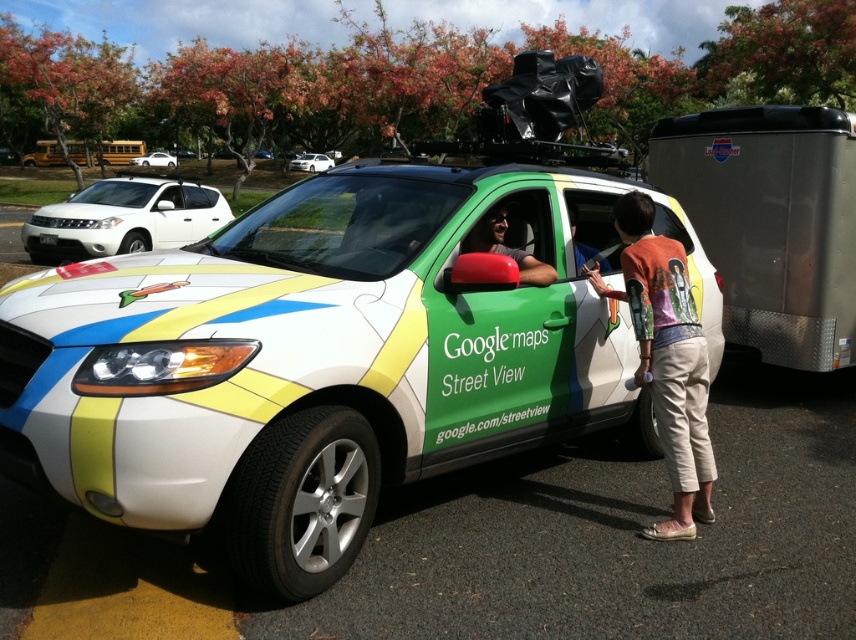
Does orange cotton shirt at center appear over white glossy sedan at center?

Actually, orange cotton shirt at center is below white glossy sedan at center.

Can you confirm if orange cotton shirt at center is taller than white glossy sedan at center?

Incorrect, orange cotton shirt at center's height is not larger of white glossy sedan at center's.

Is point (642, 342) closer to viewer compared to point (324, 161)?

Yes, point (642, 342) is in front of point (324, 161).

Identify the location of orange cotton shirt at center. This screenshot has height=640, width=856. (669, 360).

Which is more to the left, white matte suv at upper left or white glossy sedan at center?

From the viewer's perspective, white glossy sedan at center appears more on the left side.

Measure the distance from white matte suv at upper left to white glossy sedan at center.

The distance of white matte suv at upper left from white glossy sedan at center is 29.16 meters.

Is point (217, 196) more distant than point (313, 168)?

No.

Find the location of a particular element. white matte suv at upper left is located at coordinates (123, 218).

Between point (153, 177) and point (135, 157), which one is positioned in front?

Point (153, 177) is in front.

Between point (141, 216) and point (153, 150), which one is positioned behind?

The point (153, 150) is behind.

Where is `white matte suv at upper left`? This screenshot has width=856, height=640. white matte suv at upper left is located at coordinates (123, 218).

This screenshot has height=640, width=856. I want to click on white matte suv at upper left, so click(123, 218).